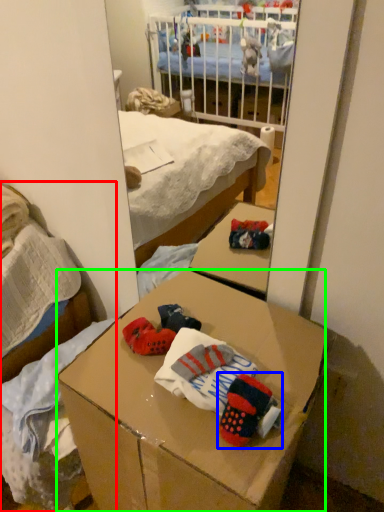
Question: Which is farther away from bed (highlighted by a red box)? toy (highlighted by a blue box) or desk (highlighted by a green box)?

Choices:
 (A) toy
 (B) desk

Answer: (A)